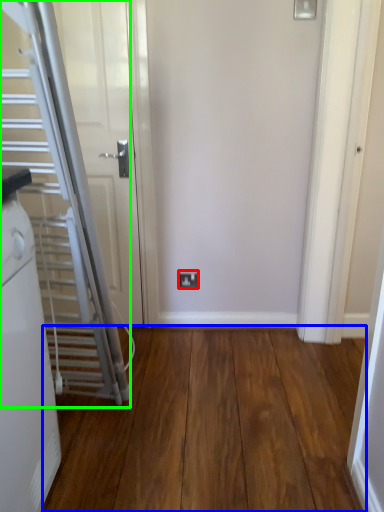
Question: Which object is positioned farthest from electric outlet (highlighted by a red box)? Select from corridor (highlighted by a blue box) and escalator (highlighted by a green box).

Choices:
 (A) corridor
 (B) escalator

Answer: (B)